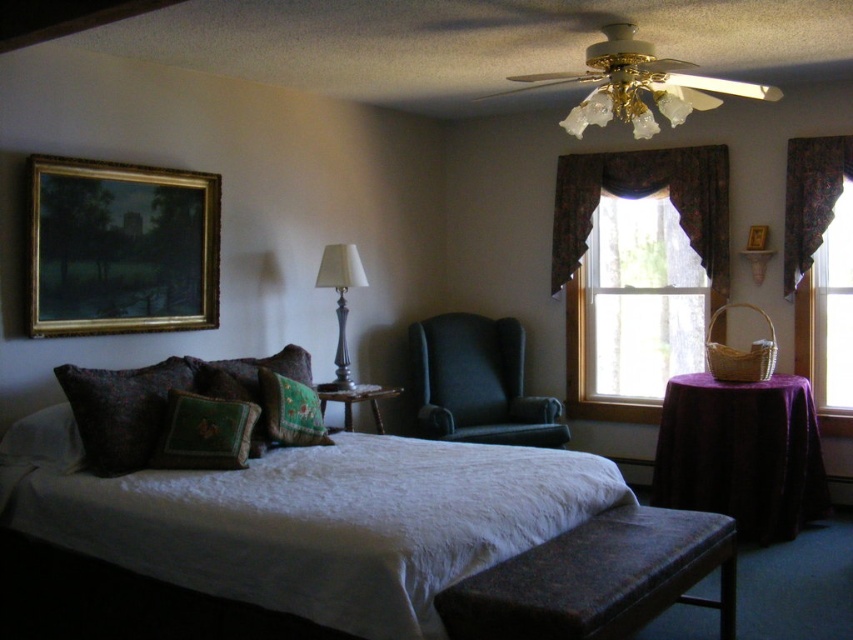
Question: Is matte gray lamp at center behind gold metallic picture frame at upper center?

Choices:
 (A) yes
 (B) no

Answer: (B)

Question: Is velvet dark brown bench at lower center closer to the viewer compared to floral fabric curtain at right?

Choices:
 (A) yes
 (B) no

Answer: (A)

Question: In this image, where is velvet dark brown bench at lower center located relative to transparent glass window at center?

Choices:
 (A) above
 (B) below

Answer: (B)

Question: Which of the following is the farthest from the observer?

Choices:
 (A) (161, 221)
 (B) (677, 212)

Answer: (B)

Question: Which point is closer to the camera?

Choices:
 (A) gold-framed painting at upper left
 (B) green embroidered pillow at center
 (C) brown textured curtain at upper center

Answer: (A)

Question: Which is nearer to the white soft bed at center?

Choices:
 (A) translucent fabric window at center
 (B) gold metallic picture frame at upper center
 (C) green textured pillow at center
 (D) green embroidered pillow at center

Answer: (C)